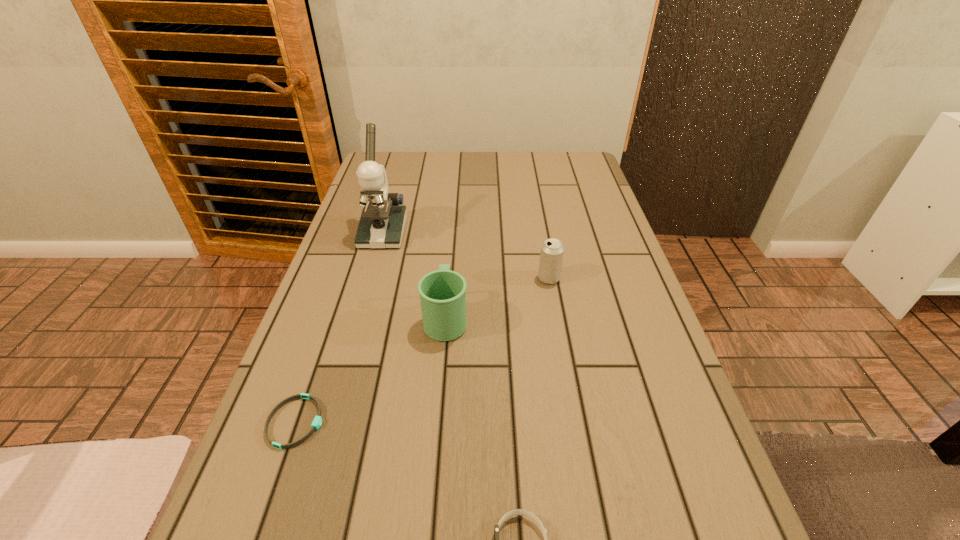
At what (x,y) coordinates should I click in order to perform the action: click on vacant region located on the side of the third nearest object with the handle. Please return your answer as a coordinate pair (x, y). Looking at the image, I should click on (454, 210).

Image resolution: width=960 pixels, height=540 pixels. Identify the location of free space located 0.310m on the side of the third nearest object with the handle. (453, 221).

What are the coordinates of `vacant space located 0.270m on the front of the fourth nearest object` in the screenshot? It's located at (566, 379).

Find the location of a particular element. free point located on the buckle of the left wristband is located at coordinates (453, 422).

Identify the location of microscope present at the left edge. Image resolution: width=960 pixels, height=540 pixels. (382, 222).

Where is `wristband that is at the left edge`? The width and height of the screenshot is (960, 540). wristband that is at the left edge is located at coordinates (316, 424).

Image resolution: width=960 pixels, height=540 pixels. Identify the location of free space at the far edge. (467, 181).

In the image, there is a desktop. Where is `vacant space at the left edge`? The height and width of the screenshot is (540, 960). vacant space at the left edge is located at coordinates (318, 386).

This screenshot has width=960, height=540. I want to click on free space at the right edge of the desktop, so click(672, 491).

This screenshot has height=540, width=960. I want to click on free region at the far left corner of the desktop, so click(x=405, y=168).